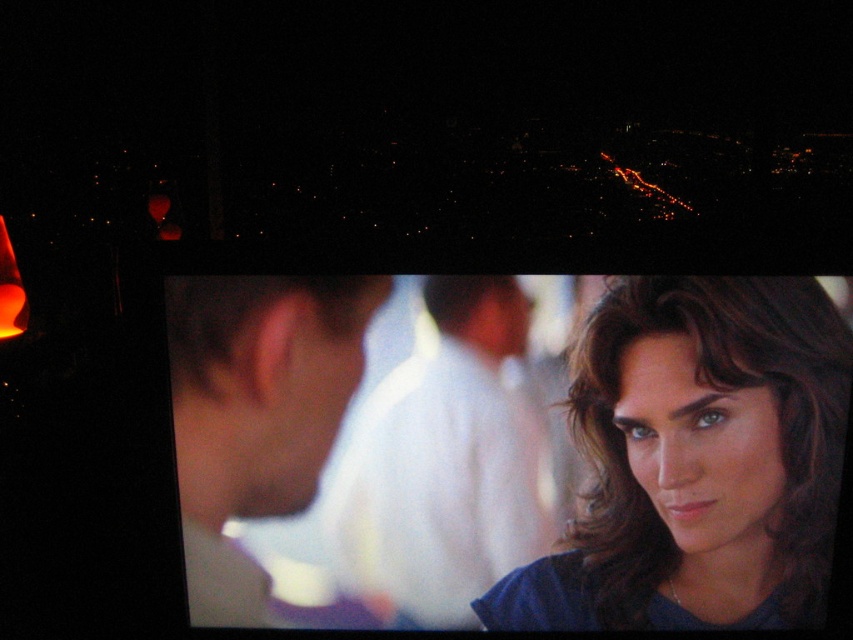
Between white cotton shirt at center and smooth skin face at center, which one has more height?

With more height is smooth skin face at center.

Which is in front, point (521, 394) or point (207, 460)?

Positioned in front is point (521, 394).

Find the location of a particular element. The image size is (853, 640). white cotton shirt at center is located at coordinates (445, 464).

You are a GUI agent. You are given a task and a screenshot of the screen. Output one action in this format:
    pyautogui.click(x=<x>, y=<y>)
    Task: Click on the white cotton shirt at center
    
    Given the screenshot: What is the action you would take?
    [445, 464]

Does matte blue shirt at center have a smaller size compared to smooth skin face at center?

No, matte blue shirt at center is not smaller than smooth skin face at center.

Is point (606, 300) positioned in front of point (339, 381)?

Yes, point (606, 300) is closer to viewer.

Who is more forward, (596, 422) or (332, 376)?

Positioned in front is point (332, 376).

You are a GUI agent. You are given a task and a screenshot of the screen. Output one action in this format:
    pyautogui.click(x=<x>, y=<y>)
    Task: Click on the matte blue shirt at center
    
    Given the screenshot: What is the action you would take?
    pyautogui.click(x=697, y=461)

Does matte blue shirt at center have a greater height compared to white cotton shirt at center?

Indeed, matte blue shirt at center has a greater height compared to white cotton shirt at center.

Which of these two, matte blue shirt at center or white cotton shirt at center, stands taller?

matte blue shirt at center

Is point (746, 419) behind point (381, 474)?

No, (746, 419) is closer to viewer.

Locate an element on the screen. Image resolution: width=853 pixels, height=640 pixels. matte blue shirt at center is located at coordinates (697, 461).